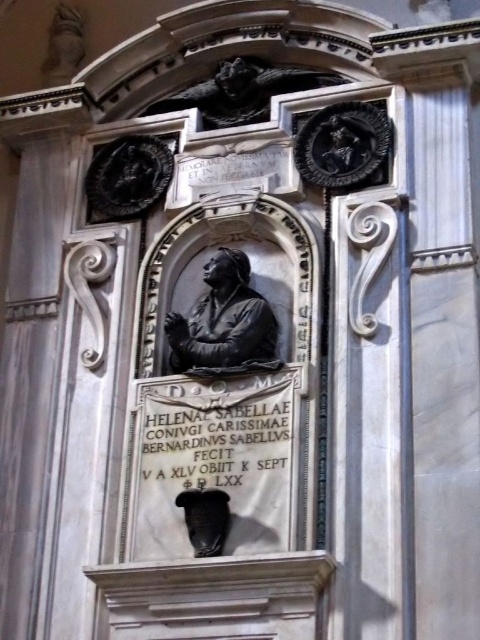
You are an art conservator examining the marble memorial plaque. You need to clean both the black stone gargoyle at upper center and the matte black bust at lower center. Which object should you clean first if you want to start with the one closer to you?

The black stone gargoyle at upper center is closer to you than the matte black bust at lower center, so you should clean the black stone gargoyle at upper center first.

You are an art conservator examining the marble memorial plaque. You need to clean both the black polished stone statue at center and the matte black bust at lower center. Which object should you start with if you want to work on the one closer to you first?

You should start with the black polished stone statue at center because it is closer to you than the matte black bust at lower center.

You are an art conservator assessing the memorial plaque. You notice the black polished stone statue at center and the black stone gargoyle at upper center. Which of these two objects is bigger in size?

The black polished stone statue at center is larger in size than the black stone gargoyle at upper center.